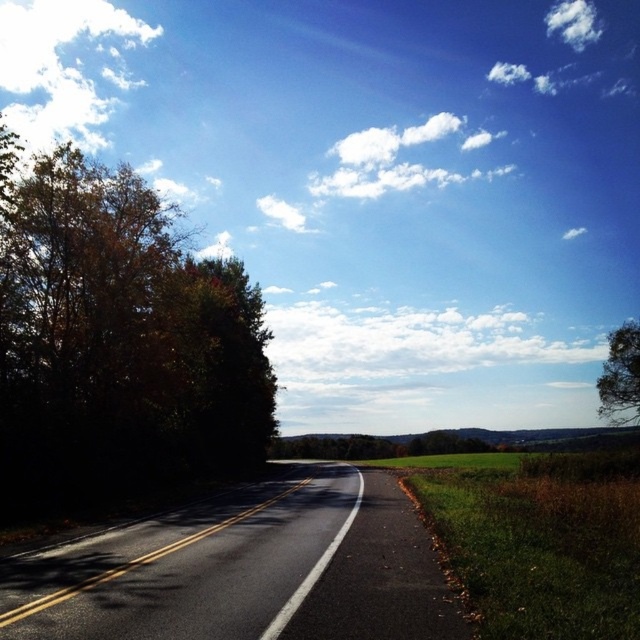
Does green leafy tree at left have a larger size compared to black asphalt road at center?

Correct, green leafy tree at left is larger in size than black asphalt road at center.

Who is taller, green leafy tree at left or black asphalt road at center?

green leafy tree at left

Where is `green leafy tree at left`? The image size is (640, 640). green leafy tree at left is located at coordinates (116, 339).

Is green leafy tree at left positioned before green leafy tree at right?

Yes, green leafy tree at left is closer to the viewer.

Who is higher up, green leafy tree at left or green leafy tree at right?

green leafy tree at left

Measure the distance between green leafy tree at left and camera.

A distance of 20.37 meters exists between green leafy tree at left and camera.

I want to click on green leafy tree at left, so click(x=116, y=339).

Who is positioned more to the right, black asphalt road at center or green leafy tree at right?

green leafy tree at right is more to the right.

Which is behind, point (429, 547) or point (637, 321)?

The point (637, 321) is more distant.

This screenshot has height=640, width=640. In order to click on black asphalt road at center in this screenshot , I will do coord(244,570).